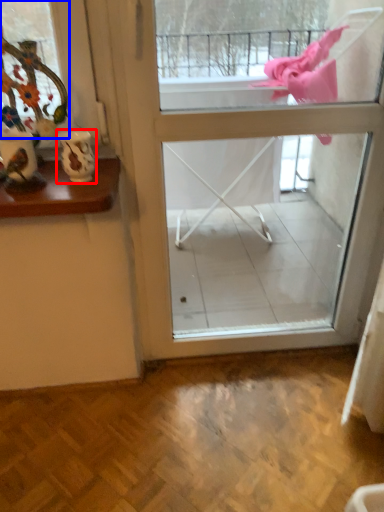
Question: Which point is closer to the camera, vase (highlighted by a red box) or window (highlighted by a blue box)?

Choices:
 (A) vase
 (B) window

Answer: (B)